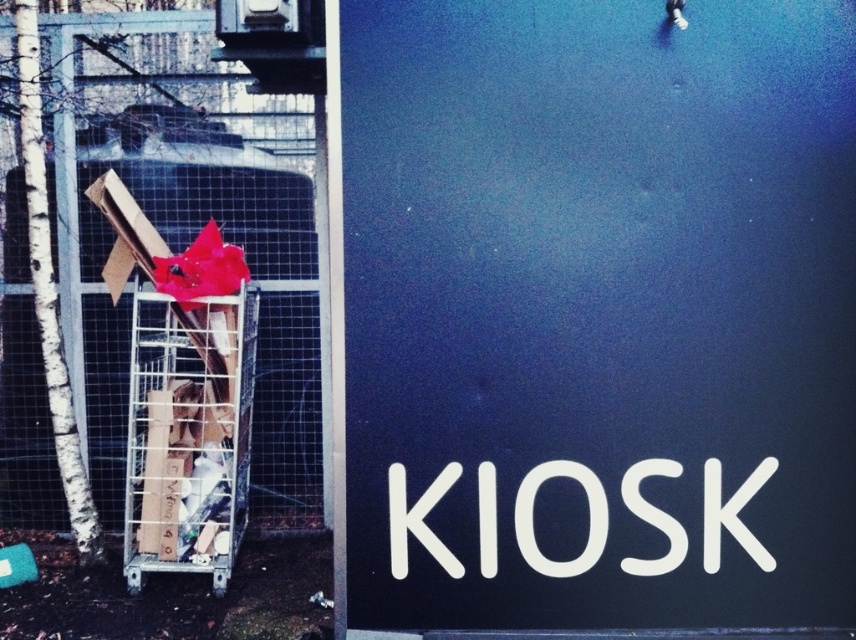
You are a delivery person carrying a 16 inch wide package. You need to pass between the metal mesh fence at left and the metallic silver shopping cart at left. Will you be able to fit through the space?

The distance between the metal mesh fence at left and the metallic silver shopping cart at left is 15.55 inches, which is narrower than the 16 inch wide package. Therefore, the package will not fit through the space.

You are standing in the middle of the scene and see the point marked at coordinates (598,316). What object is located at that point?

The point at (598,316) marks the location of the black matte sign at center.

You are designing a layout for a new public space and want to ensure that the black matte sign at center is visible above the metallic silver shopping cart at left. Based on the scene, will the sign be visible from a distance? Explain your reasoning.

The black matte sign at center is taller than the metallic silver shopping cart at left, so it will be visible above the cart from a distance.